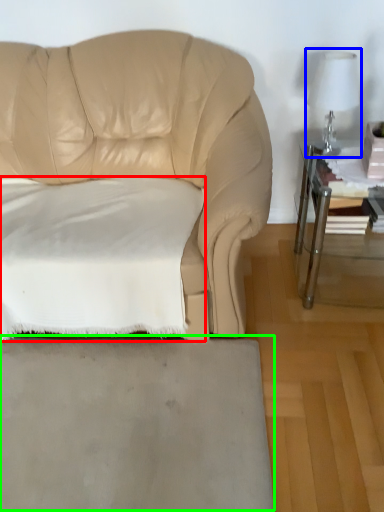
Question: Which object is positioned closest to pillow (highlighted by a red box)? Select from table lamp (highlighted by a blue box) and concrete (highlighted by a green box).

Choices:
 (A) table lamp
 (B) concrete

Answer: (B)